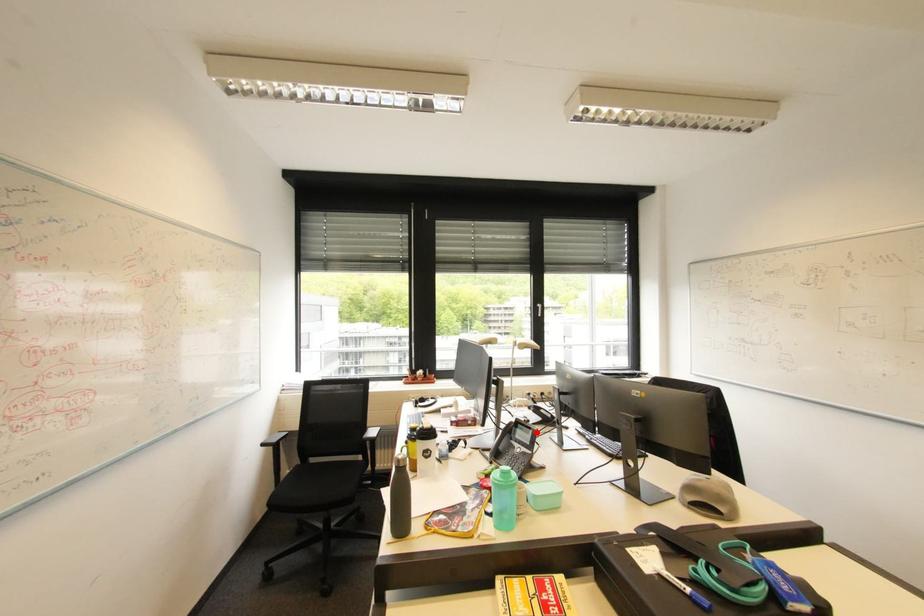
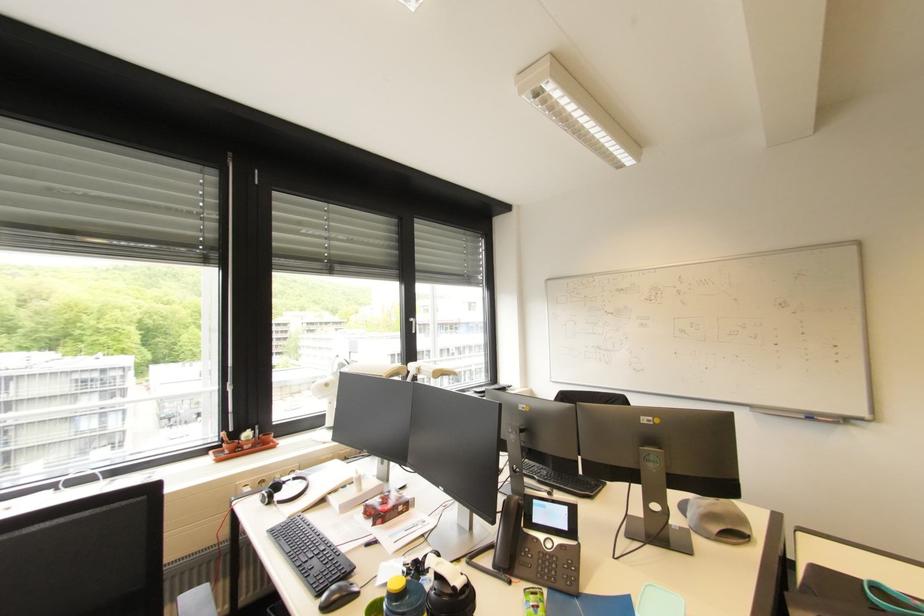
In the second image, find the point that corresponds to the highlighted location in the first image.

(572, 509)